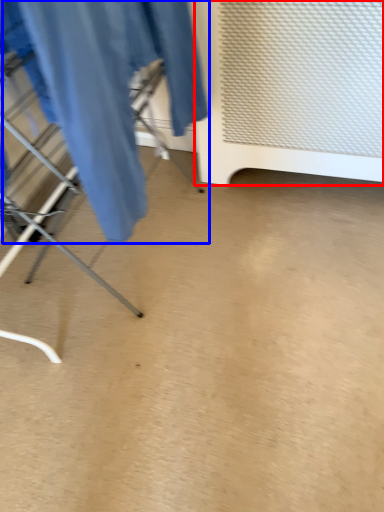
Question: Which of the following is the closest to the observer, furniture (highlighted by a red box) or clothing (highlighted by a blue box)?

Choices:
 (A) furniture
 (B) clothing

Answer: (B)